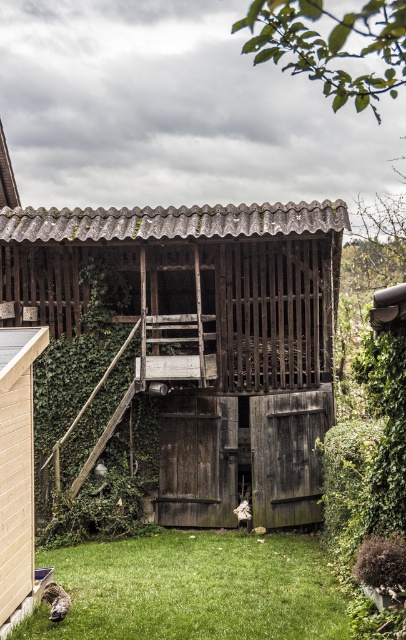
Is weathered wood hut at center wider than green grass at lower left?

Incorrect, weathered wood hut at center's width does not surpass green grass at lower left's.

Does weathered wood hut at center appear on the left side of green grass at lower left?

In fact, weathered wood hut at center is to the right of green grass at lower left.

Between point (313, 216) and point (267, 589), which one is positioned behind?

The point (313, 216) is more distant.

The width and height of the screenshot is (406, 640). I want to click on weathered wood hut at center, so click(205, 337).

Is green grass at lower left taller than beige wood shed at lower left?

No.

What do you see at coordinates (194, 588) in the screenshot? The width and height of the screenshot is (406, 640). I see `green grass at lower left` at bounding box center [194, 588].

The width and height of the screenshot is (406, 640). What are the coordinates of `green grass at lower left` in the screenshot? It's located at (194, 588).

Does weathered wood hut at center lie in front of beige wood shed at lower left?

No, it is not.

Is weathered wood hut at center behind beige wood shed at lower left?

Yes, weathered wood hut at center is further from the viewer.

Is point (315, 412) behind point (2, 616)?

Yes.

Where is `weathered wood hut at center`? This screenshot has width=406, height=640. weathered wood hut at center is located at coordinates (x=205, y=337).